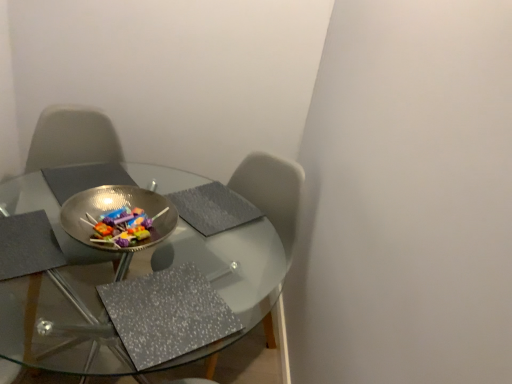
Identify the location of transparent glass table at center. (226, 275).

This screenshot has width=512, height=384. Describe the element at coordinates (226, 275) in the screenshot. I see `transparent glass table at center` at that location.

The width and height of the screenshot is (512, 384). What do you see at coordinates (116, 208) in the screenshot?
I see `metallic reflective bowl at center` at bounding box center [116, 208].

Where is `metallic reflective bowl at center`? The width and height of the screenshot is (512, 384). metallic reflective bowl at center is located at coordinates (116, 208).

The height and width of the screenshot is (384, 512). I want to click on transparent glass table at center, so click(226, 275).

Considering the positions of objects metallic reflective bowl at center and transparent glass table at center in the image provided, who is more to the right, metallic reflective bowl at center or transparent glass table at center?

From the viewer's perspective, metallic reflective bowl at center appears more on the right side.

Considering the positions of objects metallic reflective bowl at center and transparent glass table at center in the image provided, who is behind, metallic reflective bowl at center or transparent glass table at center?

metallic reflective bowl at center is more distant.

Which is behind, point (147, 190) or point (245, 270)?

Point (245, 270)

Based on the photo, from the image's perspective, is metallic reflective bowl at center located above or below transparent glass table at center?

Clearly, from the image's perspective, metallic reflective bowl at center is above transparent glass table at center.

From a real-world perspective, is metallic reflective bowl at center positioned above or below transparent glass table at center?

In terms of real-world spatial position, metallic reflective bowl at center is above transparent glass table at center.

Considering the sizes of metallic reflective bowl at center and transparent glass table at center in the image, is metallic reflective bowl at center wider or thinner than transparent glass table at center?

metallic reflective bowl at center is thinner than transparent glass table at center.

Is metallic reflective bowl at center shorter than transparent glass table at center?

Correct, metallic reflective bowl at center is not as tall as transparent glass table at center.

Does metallic reflective bowl at center have a larger size compared to transparent glass table at center?

No, metallic reflective bowl at center is not bigger than transparent glass table at center.

Do you think metallic reflective bowl at center is within transparent glass table at center, or outside of it?

The correct answer is: outside.

Does metallic reflective bowl at center touch transparent glass table at center?

No, metallic reflective bowl at center is not making contact with transparent glass table at center.

Is metallic reflective bowl at center oriented towards transparent glass table at center?

No, metallic reflective bowl at center does not turn towards transparent glass table at center.

Measure the distance between metallic reflective bowl at center and transparent glass table at center.

metallic reflective bowl at center and transparent glass table at center are 16.97 inches apart from each other.

There is a transparent glass table at center. Where is `bowl above it (from a real-world perspective)`? bowl above it (from a real-world perspective) is located at coordinates (116, 208).

Can you confirm if transparent glass table at center is positioned to the left of metallic reflective bowl at center?

Correct, you'll find transparent glass table at center to the left of metallic reflective bowl at center.

In the image, is transparent glass table at center positioned in front of or behind metallic reflective bowl at center?

transparent glass table at center is positioned closer to the viewer than metallic reflective bowl at center.

Which is behind, point (77, 247) or point (104, 199)?

The point (77, 247) is farther from the camera.

From the image's perspective, which is above, transparent glass table at center or metallic reflective bowl at center?

metallic reflective bowl at center is shown above in the image.

From a real-world perspective, is transparent glass table at center under metallic reflective bowl at center?

Yes, from a real-world perspective, transparent glass table at center is beneath metallic reflective bowl at center.

Which of these two, transparent glass table at center or metallic reflective bowl at center, is wider?

Wider between the two is transparent glass table at center.

From their relative heights in the image, would you say transparent glass table at center is taller or shorter than metallic reflective bowl at center?

Clearly, transparent glass table at center is taller compared to metallic reflective bowl at center.

Considering the sizes of objects transparent glass table at center and metallic reflective bowl at center in the image provided, who is smaller, transparent glass table at center or metallic reflective bowl at center?

With smaller size is metallic reflective bowl at center.

Is metallic reflective bowl at center located within transparent glass table at center?

No.

Is transparent glass table at center not near metallic reflective bowl at center?

No, transparent glass table at center is not far away from metallic reflective bowl at center.

Is transparent glass table at center facing away from metallic reflective bowl at center?

That's not correct — transparent glass table at center is not looking away from metallic reflective bowl at center.

The width and height of the screenshot is (512, 384). I want to click on bowl that appears above the transparent glass table at center (from the image's perspective), so click(x=116, y=208).

This screenshot has width=512, height=384. I want to click on bowl that is above the transparent glass table at center (from a real-world perspective), so click(116, 208).

Find the location of a particular element. The image size is (512, 384). bowl above the transparent glass table at center (from the image's perspective) is located at coordinates (116, 208).